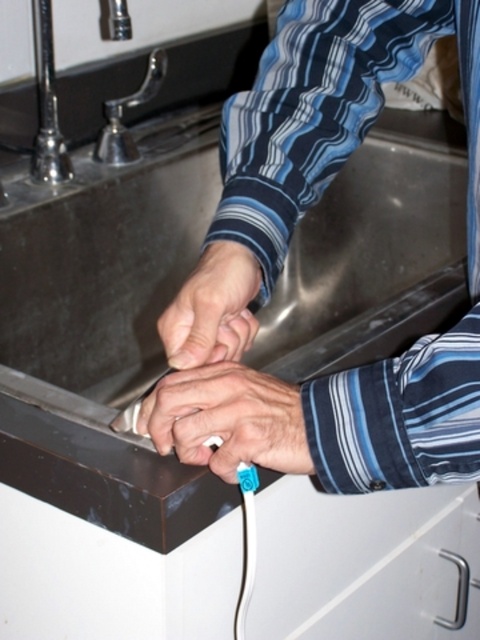
You are organizing items on the dark brown countertop near the stainless steel sink. There is a blue rubber band at center. Can you place it in the lower right corner of the countertop without moving any other objects?

The blue rubber band at center is located at point [228,419]. Since the lower right corner of the countertop is farther away from its current position, you can place it there without moving other objects.

You are a home inspector evaluating the kitchen. You notice the blue striped shirt at center and the smooth skin hand at center. Which object is positioned higher in the image?

The blue striped shirt at center is located above the smooth skin hand at center, so it is positioned higher in the image.

You are a robotic arm trying to reach the point at coordinate point (216, 349). Your maximum reach is 24 inches. Can you reach it?

The distance between the point (216, 349) and the camera is 24.34 inches, which is slightly beyond your maximum reach of 24 inches. Therefore, you cannot reach it.